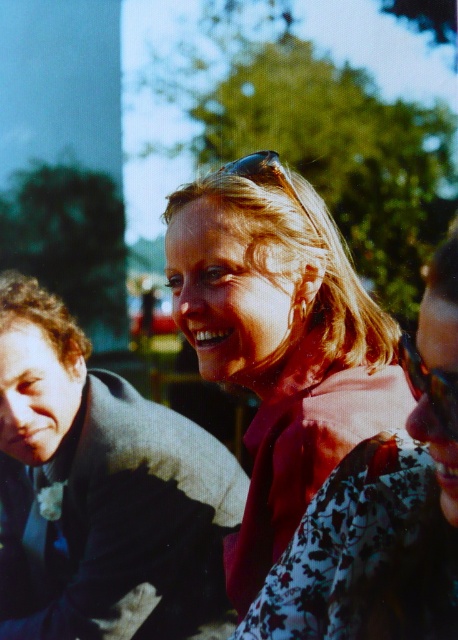
Question: Does pink fabric at center lie in front of clear plastic sunglasses at center?

Choices:
 (A) yes
 (B) no

Answer: (A)

Question: Can you confirm if dark gray suit at left is wider than clear plastic sunglasses at center?

Choices:
 (A) no
 (B) yes

Answer: (B)

Question: Which of these objects is positioned farthest from the pink fabric at center?

Choices:
 (A) translucent plastic goggles at lower right
 (B) clear plastic sunglasses at center

Answer: (A)

Question: Which point appears farthest from the camera in this image?

Choices:
 (A) (415, 381)
 (B) (333, 364)
 (C) (208, 602)
 (D) (265, 148)

Answer: (D)

Question: Which point is farther to the camera?

Choices:
 (A) (315, 193)
 (B) (218, 236)

Answer: (A)

Question: Is dark gray suit at left to the right of pink fabric at center from the viewer's perspective?

Choices:
 (A) no
 (B) yes

Answer: (A)